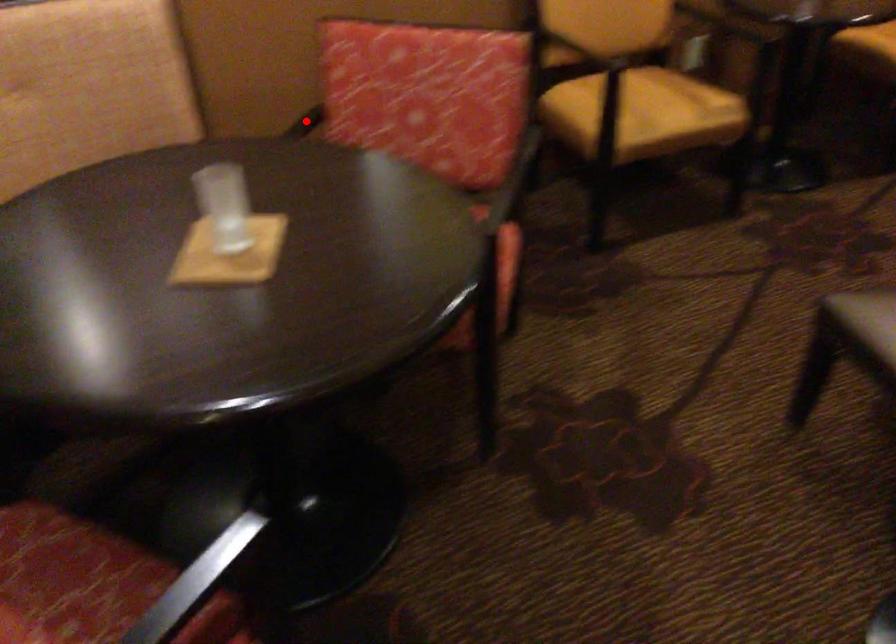
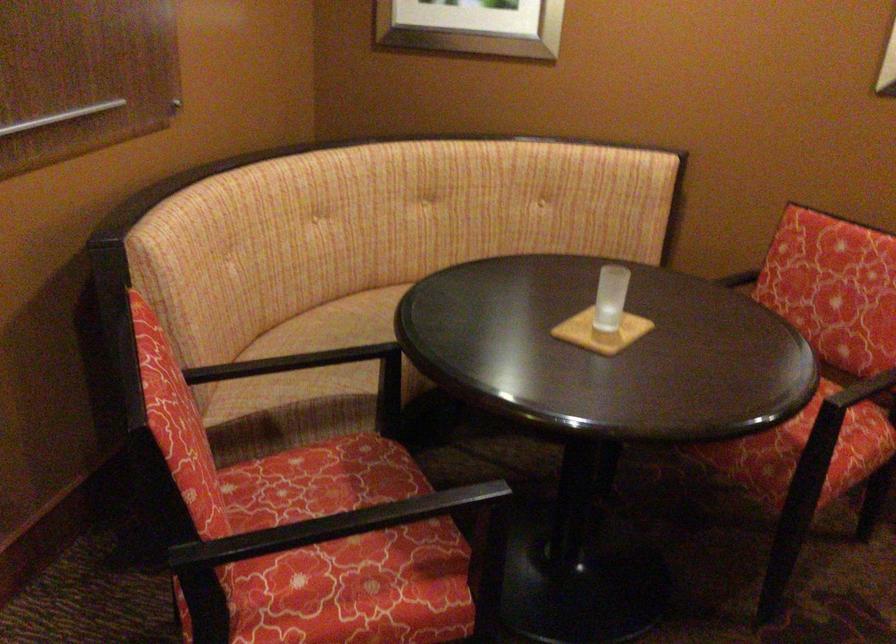
Question: I am providing you with two images of the same scene from different viewpoints. A red point is marked on the first image. At the location where the point appears in image 1, is it still visible in image 2?

Choices:
 (A) Yes
 (B) No

Answer: (A)